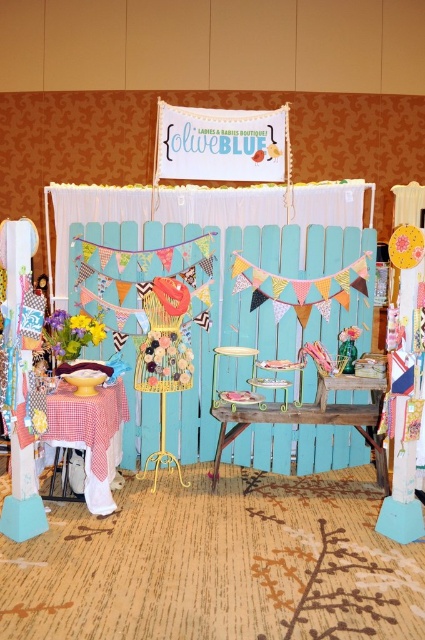
Question: Which object is closer to the camera taking this photo?

Choices:
 (A) rustic wood table at center
 (B) checkered fabric table at lower left

Answer: (B)

Question: Is the position of checkered fabric table at lower left less distant than that of rustic wood table at center?

Choices:
 (A) yes
 (B) no

Answer: (A)

Question: Is checkered fabric table at lower left below rustic wood table at center?

Choices:
 (A) no
 (B) yes

Answer: (A)

Question: Which point appears closest to the camera in this image?

Choices:
 (A) (215, 481)
 (B) (105, 422)

Answer: (B)

Question: Among these objects, which one is farthest from the camera?

Choices:
 (A) checkered fabric table at lower left
 (B) rustic wood table at center

Answer: (B)

Question: Is checkered fabric table at lower left below rustic wood table at center?

Choices:
 (A) yes
 (B) no

Answer: (B)